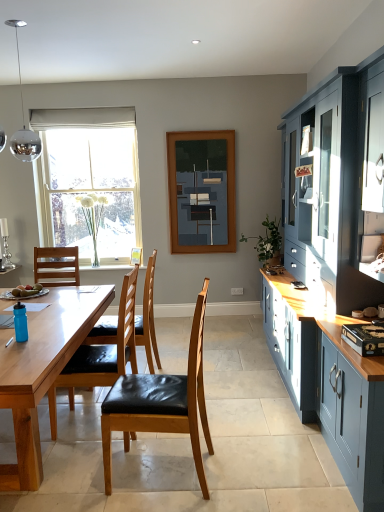
Where is `free space in front of wooden chair with black leather seat at left, the 2th chair viewed from the front`? This screenshot has height=512, width=384. free space in front of wooden chair with black leather seat at left, the 2th chair viewed from the front is located at coordinates (74, 461).